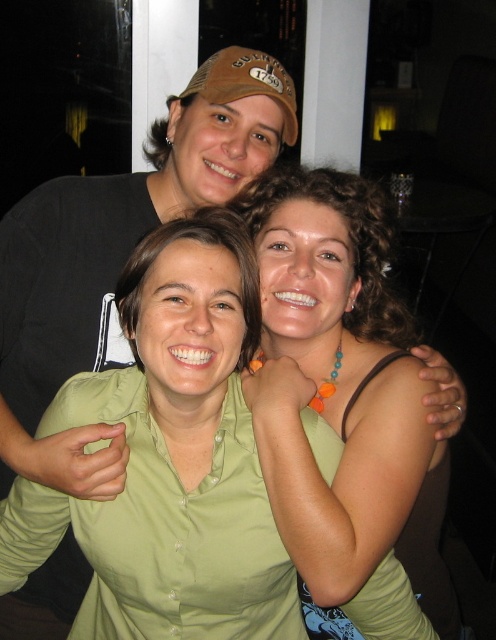
Is point (315, 456) behind point (225, 72)?

No, (315, 456) is closer to viewer.

Identify the location of green matte shirt at center. (171, 460).

Locate an element on the screen. The image size is (496, 640). green matte shirt at center is located at coordinates (171, 460).

Which is more to the left, green matte shirt at center or green fabric shirt at center?

green matte shirt at center

Does point (176, 262) come behind point (356, 580)?

Yes, point (176, 262) is behind point (356, 580).

Find the location of a particular element. green matte shirt at center is located at coordinates [171, 460].

Is green fabric shirt at center bigger than brown fabric baseball cap at upper center?

Yes.

Is point (373, 225) in front of point (208, 92)?

Yes, point (373, 225) is closer to viewer.

The height and width of the screenshot is (640, 496). I want to click on green fabric shirt at center, so click(333, 372).